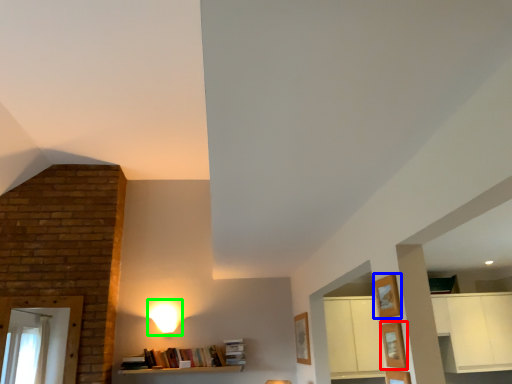
Question: Considering the real-world distances, which object is closest to shelf (highlighted by a red box)? shelf (highlighted by a blue box) or lamp (highlighted by a green box).

Choices:
 (A) shelf
 (B) lamp

Answer: (A)